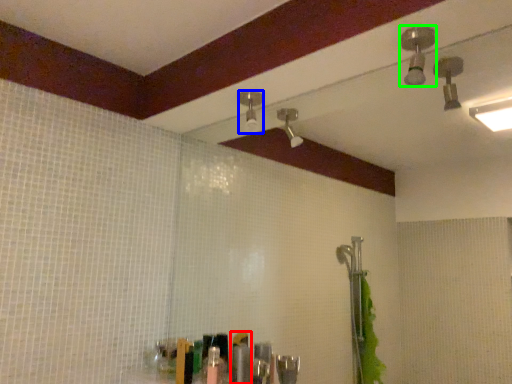
Question: Which object is the farthest from toiletry (highlighted by a red box)? Choose among these: shower (highlighted by a blue box) or shower (highlighted by a green box).

Choices:
 (A) shower
 (B) shower

Answer: (B)